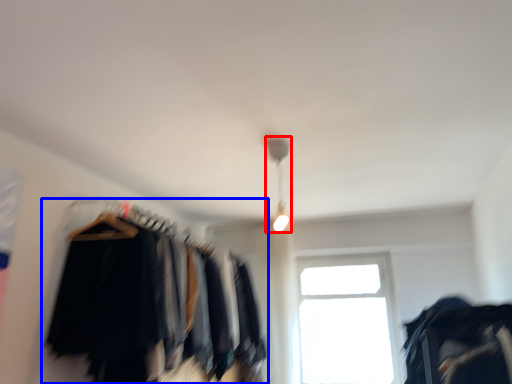
Question: Which of the following is the closest to the observer, lamp (highlighted by a red box) or closet (highlighted by a blue box)?

Choices:
 (A) lamp
 (B) closet

Answer: (B)